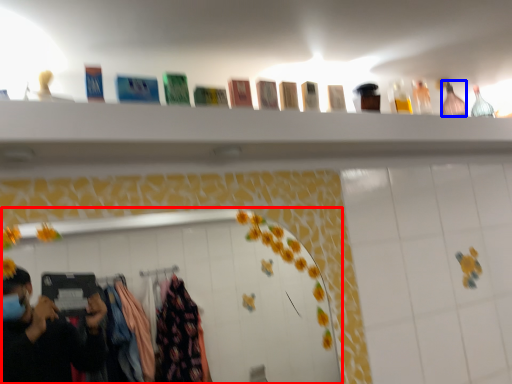
Question: Which object appears farthest to the camera in this image, mirror (highlighted by a red box) or bottle (highlighted by a blue box)?

Choices:
 (A) mirror
 (B) bottle

Answer: (B)